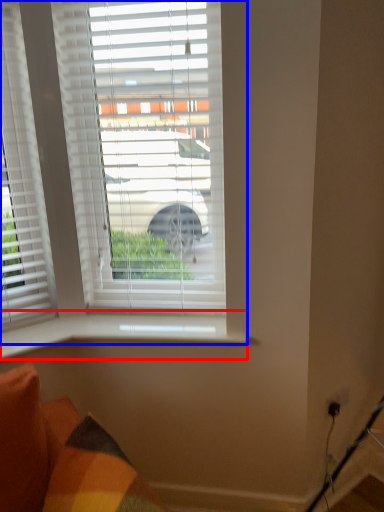
Question: Among these objects, which one is farthest to the camera, window sill (highlighted by a red box) or window (highlighted by a blue box)?

Choices:
 (A) window sill
 (B) window

Answer: (A)